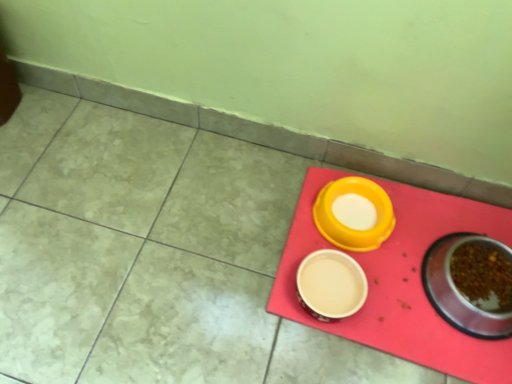
Image resolution: width=512 pixels, height=384 pixels. I want to click on free space above rubberized red tray at lower right (from a real-world perspective), so click(401, 268).